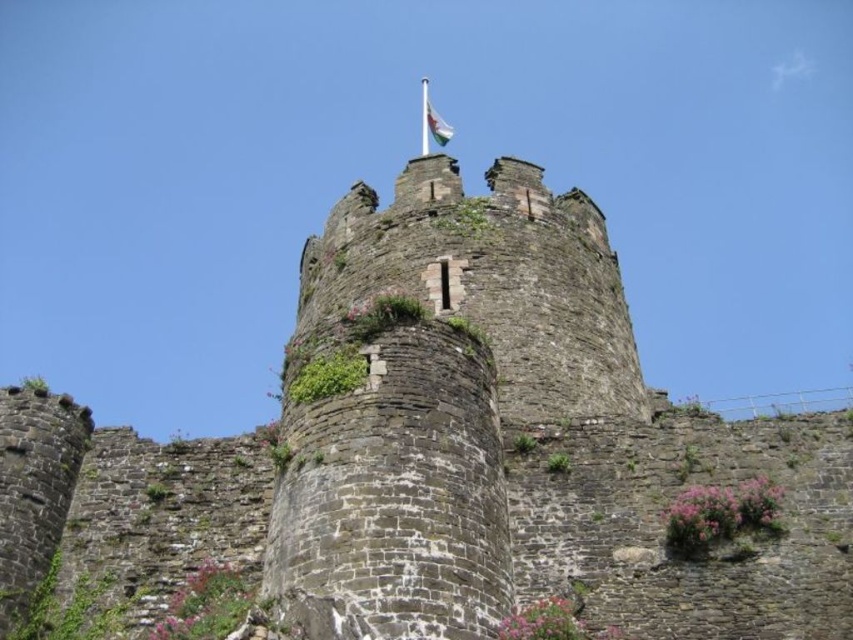
Looking at this image, is white fabric flag at top in front of white fabric flagpole at top?

Yes.

Is point (450, 134) in front of point (425, 131)?

Yes, it is in front of point (425, 131).

I want to click on white fabric flag at top, so click(436, 124).